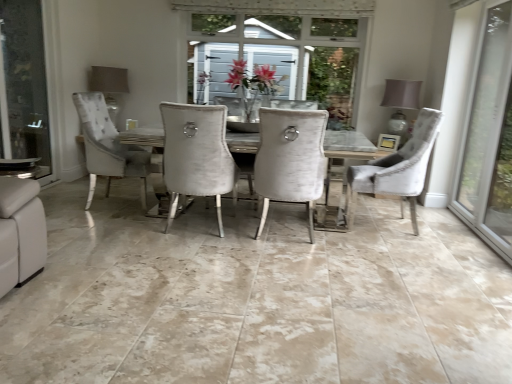
Image resolution: width=512 pixels, height=384 pixels. What do you see at coordinates (400, 102) in the screenshot?
I see `matte gray lampshade at upper right, the second lamp when ordered from left to right` at bounding box center [400, 102].

Consider the image. Measure the distance between point (x=300, y=131) and camera.

A distance of 9.80 feet exists between point (x=300, y=131) and camera.

I want to click on transparent glass door at right, so click(488, 135).

Does velvet grey chair at right, which appears as the second chair when viewed from the left, have a greater width compared to matte gray lampshade at upper right, the second lamp when ordered from left to right?

Yes.

Which object is closer to the camera, velvet grey chair at right, which appears as the second chair when viewed from the left, or matte gray lampshade at upper right, the second lamp when ordered from left to right?

velvet grey chair at right, which appears as the second chair when viewed from the left, is in front.

Are velvet grey chair at right, which appears as the second chair when viewed from the left, and matte gray lampshade at upper right, the second lamp when ordered from left to right, beside each other?

No, velvet grey chair at right, which appears as the second chair when viewed from the left, is not in contact with matte gray lampshade at upper right, the second lamp when ordered from left to right.

Is matte gray lampshade at upper left, which is counted as the 1th lamp, starting from the left, oriented away from transparent glass door at right?

No, matte gray lampshade at upper left, which is counted as the 1th lamp, starting from the left, is not facing away from transparent glass door at right.

From a real-world perspective, is matte gray lampshade at upper left, which is counted as the 1th lamp, starting from the left, physically located above or below transparent glass door at right?

In terms of real-world spatial position, matte gray lampshade at upper left, which is counted as the 1th lamp, starting from the left, is below transparent glass door at right.

Locate an element on the screen. the 2nd lamp behind the transparent glass door at right, counting from the anchor's position is located at coordinates (109, 86).

Is matte gray lampshade at upper left, which is counted as the 1th lamp, starting from the left, in front of transparent glass door at right?

No, matte gray lampshade at upper left, which is counted as the 1th lamp, starting from the left, is further to the viewer.

Which object is wider, matte gray lampshade at upper left, marked as the 2th lamp in a right-to-left arrangement, or matte gray lampshade at upper right, the second lamp when ordered from left to right?

With larger width is matte gray lampshade at upper right, the second lamp when ordered from left to right.

Is matte gray lampshade at upper left, marked as the 2th lamp in a right-to-left arrangement, positioned far away from matte gray lampshade at upper right, the second lamp when ordered from left to right?

That's right, there is a large distance between matte gray lampshade at upper left, marked as the 2th lamp in a right-to-left arrangement, and matte gray lampshade at upper right, the second lamp when ordered from left to right.

Find the location of `lamp that appears on the right of matte gray lampshade at upper left, marked as the 2th lamp in a right-to-left arrangement`. lamp that appears on the right of matte gray lampshade at upper left, marked as the 2th lamp in a right-to-left arrangement is located at coordinates (400, 102).

Between matte gray lampshade at upper left, marked as the 2th lamp in a right-to-left arrangement, and matte gray lampshade at upper right, which is the 1th lamp from right to left, which one appears on the left side from the viewer's perspective?

From the viewer's perspective, matte gray lampshade at upper left, marked as the 2th lamp in a right-to-left arrangement, appears more on the left side.

Is point (29, 85) more distant than point (109, 72)?

No, (29, 85) is closer to viewer.

Is clear glass screen door at left facing away from matte gray lampshade at upper left, marked as the 2th lamp in a right-to-left arrangement?

No, matte gray lampshade at upper left, marked as the 2th lamp in a right-to-left arrangement, is not at the back of clear glass screen door at left.

Is clear glass screen door at left to the left or to the right of matte gray lampshade at upper left, marked as the 2th lamp in a right-to-left arrangement, in the image?

Based on their positions, clear glass screen door at left is located to the left of matte gray lampshade at upper left, marked as the 2th lamp in a right-to-left arrangement.

Is clear glass screen door at left taller or shorter than matte gray lampshade at upper left, which is counted as the 1th lamp, starting from the left?

Clearly, clear glass screen door at left is taller compared to matte gray lampshade at upper left, which is counted as the 1th lamp, starting from the left.

Is transparent glass door at right oriented away from matte gray lampshade at upper right, which is the 1th lamp from right to left?

No.

How different are the orientations of transparent glass door at right and matte gray lampshade at upper right, which is the 1th lamp from right to left, in degrees?

There is a 90-degree angle between the facing directions of transparent glass door at right and matte gray lampshade at upper right, which is the 1th lamp from right to left.

Is transparent glass door at right positioned before matte gray lampshade at upper right, the second lamp when ordered from left to right?

Yes, the depth of transparent glass door at right is less than that of matte gray lampshade at upper right, the second lamp when ordered from left to right.

Between transparent glass door at right and matte gray lampshade at upper right, which is the 1th lamp from right to left, which one has smaller width?

transparent glass door at right.

Can we say transparent glass door at right lies outside matte gray lampshade at upper left, which is counted as the 1th lamp, starting from the left?

Yes, transparent glass door at right is not within matte gray lampshade at upper left, which is counted as the 1th lamp, starting from the left.

From the image's perspective, does transparent glass door at right appear higher than matte gray lampshade at upper left, marked as the 2th lamp in a right-to-left arrangement?

No, from the image's perspective, transparent glass door at right is not above matte gray lampshade at upper left, marked as the 2th lamp in a right-to-left arrangement.

Between transparent glass door at right and matte gray lampshade at upper left, marked as the 2th lamp in a right-to-left arrangement, which one appears on the right side from the viewer's perspective?

transparent glass door at right is more to the right.

Which point is more distant from viewer, (2, 88) or (501, 161)?

The point (2, 88) is behind.

Who is taller, clear glass screen door at left or transparent glass door at right?

Standing taller between the two is transparent glass door at right.

Is clear glass screen door at left in contact with transparent glass door at right?

No, clear glass screen door at left is not with transparent glass door at right.

Does clear glass screen door at left contain transparent glass door at right?

No.

Which lamp is the 1st one when counting from the back of the velvet grey chair at right, which appears as the second chair when viewed from the left? Please provide its 2D coordinates.

[(400, 102)]

At what (x,y) coordinates should I click in order to perform the action: click on the 2nd lamp positioned below the transparent glass door at right (from a real-world perspective). Please return your answer as a coordinate pair (x, y). Looking at the image, I should click on (109, 86).

Looking at the image, which one is located further to matte gray lampshade at upper left, marked as the 2th lamp in a right-to-left arrangement, matte gray lampshade at upper right, which is the 1th lamp from right to left, or velvet white chair at center, placed as the first chair when sorted from left to right?

matte gray lampshade at upper right, which is the 1th lamp from right to left, lies further to matte gray lampshade at upper left, marked as the 2th lamp in a right-to-left arrangement, than the other object.

Estimate the real-world distances between objects in this image. Which object is closer to clear glass screen door at left, velvet grey chair at right, which appears as the second chair when viewed from the left, or velvet white chair at center, placed as the first chair when sorted from left to right?

Based on the image, velvet white chair at center, placed as the first chair when sorted from left to right, appears to be nearer to clear glass screen door at left.

From the image, which object appears to be nearer to matte gray lampshade at upper left, marked as the 2th lamp in a right-to-left arrangement, matte gray lampshade at upper right, which is the 1th lamp from right to left, or transparent glass door at right?

Among the two, matte gray lampshade at upper right, which is the 1th lamp from right to left, is located nearer to matte gray lampshade at upper left, marked as the 2th lamp in a right-to-left arrangement.

Considering their positions, is matte gray lampshade at upper left, which is counted as the 1th lamp, starting from the left, positioned closer to matte gray lampshade at upper right, the second lamp when ordered from left to right, than transparent glass door at right?

transparent glass door at right is closer to matte gray lampshade at upper right, the second lamp when ordered from left to right.

Based on their spatial positions, is velvet white chair at center, placed as the first chair when sorted from left to right, or transparent glass door at right closer to clear glass screen door at left?

velvet white chair at center, placed as the first chair when sorted from left to right, lies closer to clear glass screen door at left than the other object.

Which object lies further to the anchor point matte gray lampshade at upper left, marked as the 2th lamp in a right-to-left arrangement, velvet grey chair at right, which appears as the second chair when viewed from the left, or clear glass screen door at left?

Based on the image, velvet grey chair at right, which appears as the second chair when viewed from the left, appears to be further to matte gray lampshade at upper left, marked as the 2th lamp in a right-to-left arrangement.

Looking at the image, which one is located further to clear glass screen door at left, velvet grey chair at right, the 1th chair in the right-to-left sequence, or transparent glass door at right?

transparent glass door at right lies further to clear glass screen door at left than the other object.

Estimate the real-world distances between objects in this image. Which object is closer to matte gray lampshade at upper left, which is counted as the 1th lamp, starting from the left, clear glass screen door at left or matte gray lampshade at upper right, the second lamp when ordered from left to right?

clear glass screen door at left lies closer to matte gray lampshade at upper left, which is counted as the 1th lamp, starting from the left, than the other object.

Where is `chair located between velvet white chair at center, placed as the first chair when sorted from left to right, and matte gray lampshade at upper right, the second lamp when ordered from left to right, in the depth direction`? Image resolution: width=512 pixels, height=384 pixels. chair located between velvet white chair at center, placed as the first chair when sorted from left to right, and matte gray lampshade at upper right, the second lamp when ordered from left to right, in the depth direction is located at coordinates (396, 169).

Image resolution: width=512 pixels, height=384 pixels. Find the location of `lamp between matte gray lampshade at upper left, marked as the 2th lamp in a right-to-left arrangement, and transparent glass door at right from left to right`. lamp between matte gray lampshade at upper left, marked as the 2th lamp in a right-to-left arrangement, and transparent glass door at right from left to right is located at coordinates (x=400, y=102).

Where is `lamp between clear glass screen door at left and matte gray lampshade at upper right, the second lamp when ordered from left to right, from left to right`? The height and width of the screenshot is (384, 512). lamp between clear glass screen door at left and matte gray lampshade at upper right, the second lamp when ordered from left to right, from left to right is located at coordinates (x=109, y=86).

This screenshot has height=384, width=512. Find the location of `chair located between clear glass screen door at left and velvet grey chair at right, the 1th chair in the right-to-left sequence, in the left-right direction`. chair located between clear glass screen door at left and velvet grey chair at right, the 1th chair in the right-to-left sequence, in the left-right direction is located at coordinates (290, 160).